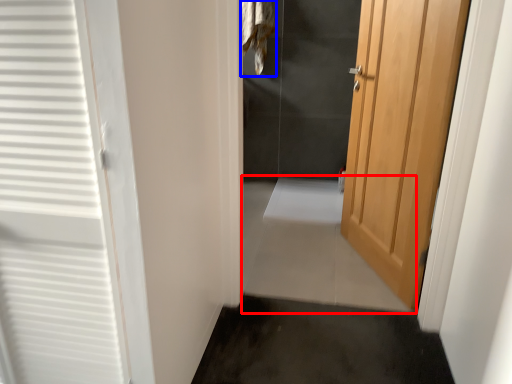
Question: Which object appears farthest to the camera in this image, path (highlighted by a red box) or laundry (highlighted by a blue box)?

Choices:
 (A) path
 (B) laundry

Answer: (B)